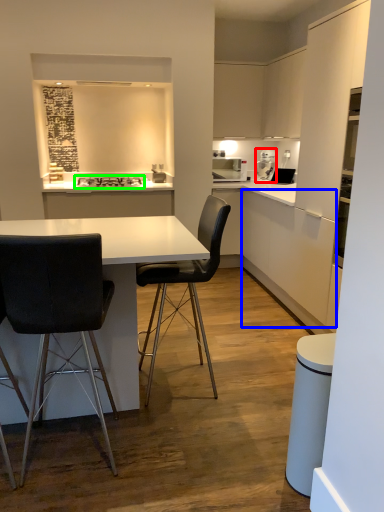
Question: Considering the real-world distances, which object is farthest from coffee machine (highlighted by a red box)? cabinetry (highlighted by a blue box) or stove (highlighted by a green box)?

Choices:
 (A) cabinetry
 (B) stove

Answer: (B)